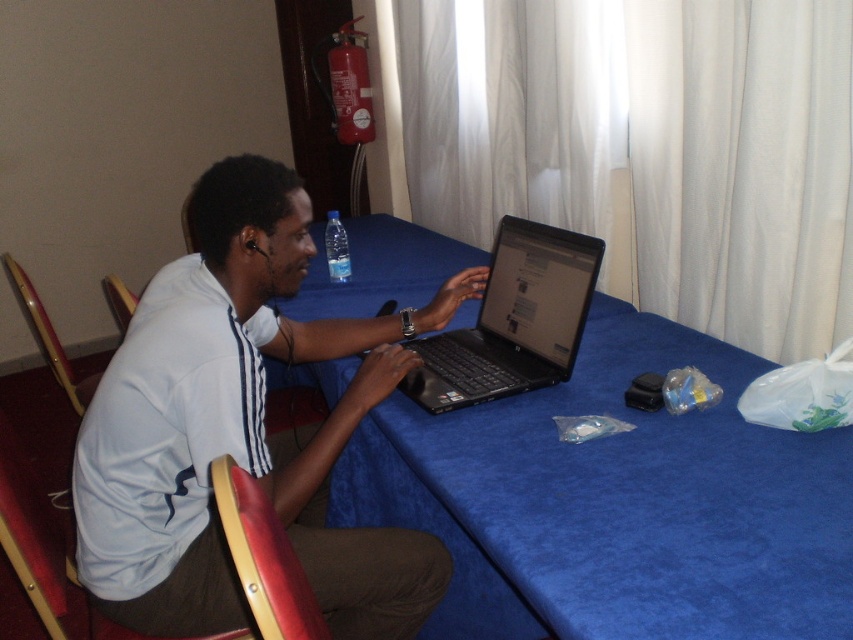
Question: Does white matte shirt at center appear on the right side of black plastic laptop at center?

Choices:
 (A) yes
 (B) no

Answer: (B)

Question: Which point appears farthest from the camera in this image?

Choices:
 (A) (537, 288)
 (B) (561, 499)
 (C) (207, 378)
 (D) (325, 234)

Answer: (D)

Question: Which of the following is the farthest from the observer?

Choices:
 (A) (534, 371)
 (B) (114, 564)
 (C) (346, 236)
 (D) (659, 547)

Answer: (C)

Question: Which point is closer to the camera taking this photo?

Choices:
 (A) (256, 280)
 (B) (602, 250)
 (C) (329, 260)
 (D) (672, 436)

Answer: (D)

Question: In this image, where is blue fabric table at center located relative to transparent plastic bottle at center?

Choices:
 (A) below
 (B) above

Answer: (A)

Question: Does black plastic laptop at center appear on the left side of transparent plastic bottle at center?

Choices:
 (A) no
 (B) yes

Answer: (A)